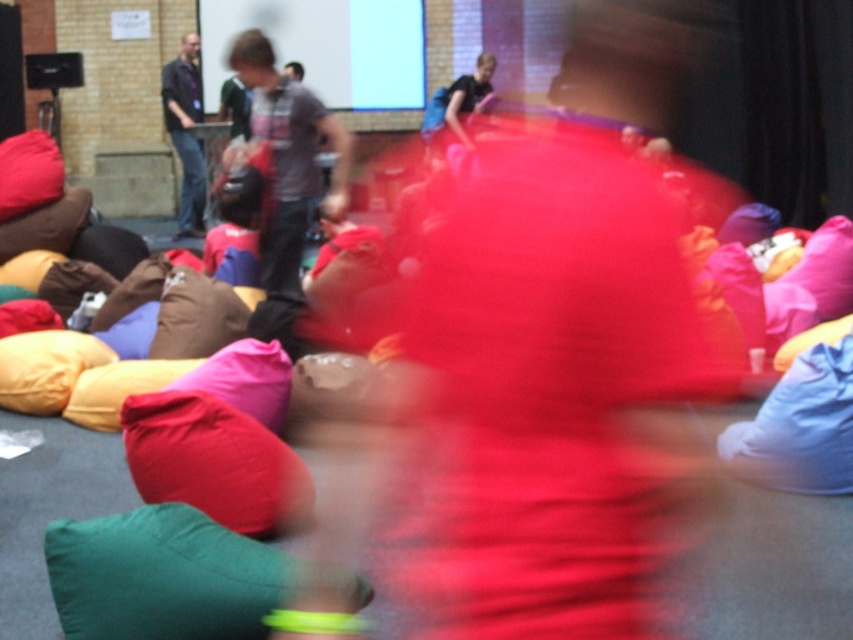
Can you confirm if velvet red cushion at lower left is positioned below dark blue jeans at left?

Yes, velvet red cushion at lower left is below dark blue jeans at left.

The height and width of the screenshot is (640, 853). Identify the location of velvet red cushion at lower left. (213, 461).

Between velvet red cushion at lower left and white glossy projection screen at upper center, which one has less height?

velvet red cushion at lower left

Is point (123, 426) positioned in front of point (199, 33)?

Yes, point (123, 426) is closer to viewer.

Describe the element at coordinates (213, 461) in the screenshot. The height and width of the screenshot is (640, 853). I see `velvet red cushion at lower left` at that location.

Where is `velvet red cushion at lower left`? velvet red cushion at lower left is located at coordinates (213, 461).

How far apart are green fabric pillow at lower left and velvet red cushion at lower left?

The distance of green fabric pillow at lower left from velvet red cushion at lower left is 25.07 inches.

You are a GUI agent. You are given a task and a screenshot of the screen. Output one action in this format:
    pyautogui.click(x=<x>, y=<y>)
    Task: Click on the green fabric pillow at lower left
    The height and width of the screenshot is (640, 853).
    Given the screenshot: What is the action you would take?
    pyautogui.click(x=161, y=577)